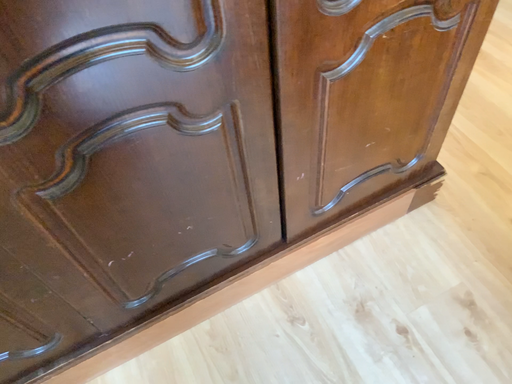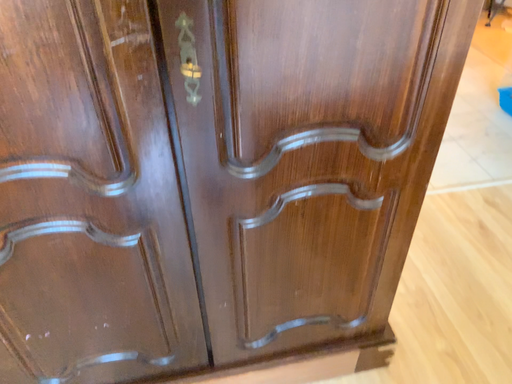
Question: How did the camera likely rotate when shooting the video?

Choices:
 (A) rotated downward
 (B) rotated upward

Answer: (B)